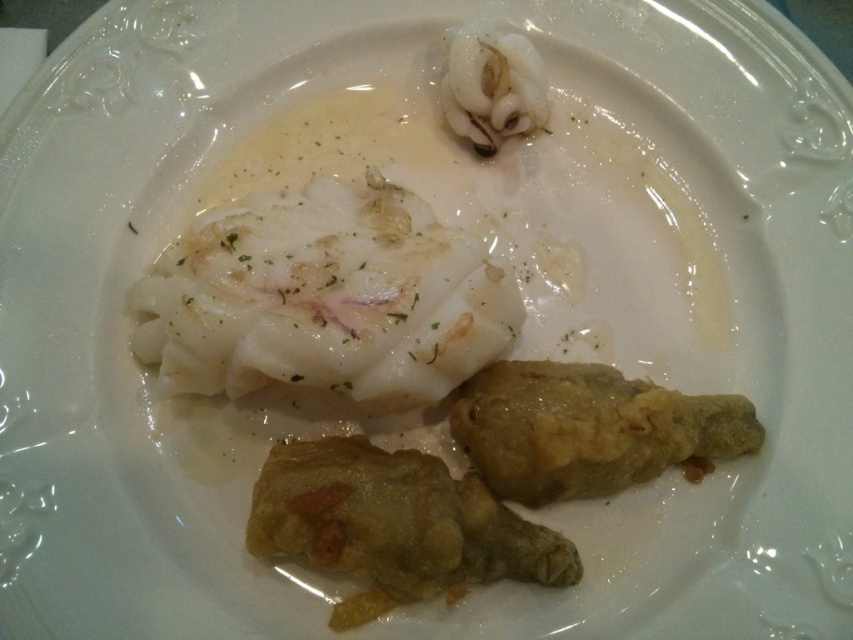
You are a food critic analyzing the composition of this dish. Based on the placement of the golden crispy fried chicken leg at lower right, can you determine its exact 2D coordinates on the plate?

The golden crispy fried chicken leg at lower right is located at the 2D coordinates of point [589,429].

You are a food critic analyzing the presentation of this dish. Based on the image, which of the two main components, the white creamy fish at center or the white glossy squid at upper center, occupies a more prominent vertical space in the composition?

The white creamy fish at center is taller than the white glossy squid at upper center, making it occupy more vertical space in the composition.

You are a food critic standing at a distance of 1 meter from the white creamy fish at center on the plate. Can you comfortably reach out and touch the fish with your hand without moving your feet?

The white creamy fish at center is 99.00 centimeters away from the viewer. Since you are standing 1 meter away, you can comfortably reach out and touch it without moving your feet.